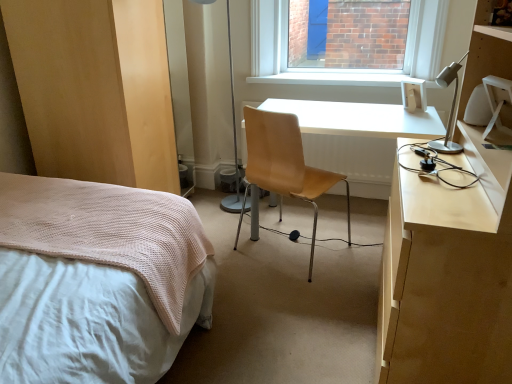
In order to click on unoccupied area in front of white glossy desk at center in this screenshot , I will do `click(316, 310)`.